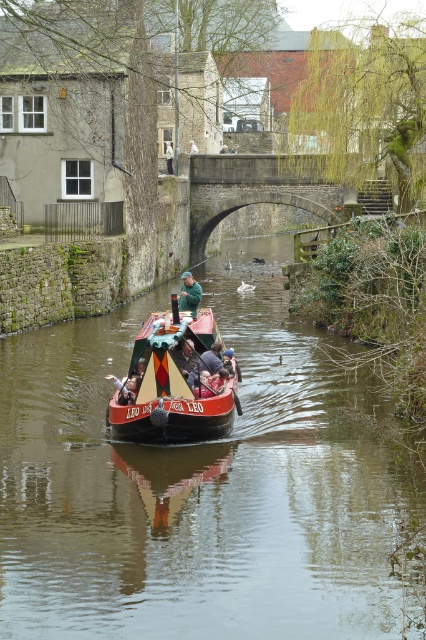
Which is more to the left, matte black hat at center or matte black jacket at center?

Positioned to the left is matte black jacket at center.

Is matte black hat at center taller than matte black jacket at center?

No.

Find the location of a particular element. This screenshot has height=640, width=426. matte black hat at center is located at coordinates (207, 362).

At what (x,y) coordinates should I click in order to perform the action: click on matte black hat at center. Please return your answer as a coordinate pair (x, y). The height and width of the screenshot is (640, 426). Looking at the image, I should click on (207, 362).

Between smooth brown water at center and white cotton shirt at center, which one has less height?

With less height is white cotton shirt at center.

Is point (46, 456) positioned in front of point (172, 147)?

That is True.

Where is `smooth brown water at center`? This screenshot has width=426, height=640. smooth brown water at center is located at coordinates (203, 483).

Does dark gray stone bridge at center have a greater height compared to matte black hat at center?

Yes, dark gray stone bridge at center is taller than matte black hat at center.

Is point (308, 195) positioned after point (207, 349)?

Yes, it is.

The height and width of the screenshot is (640, 426). Identify the location of dark gray stone bridge at center. (265, 188).